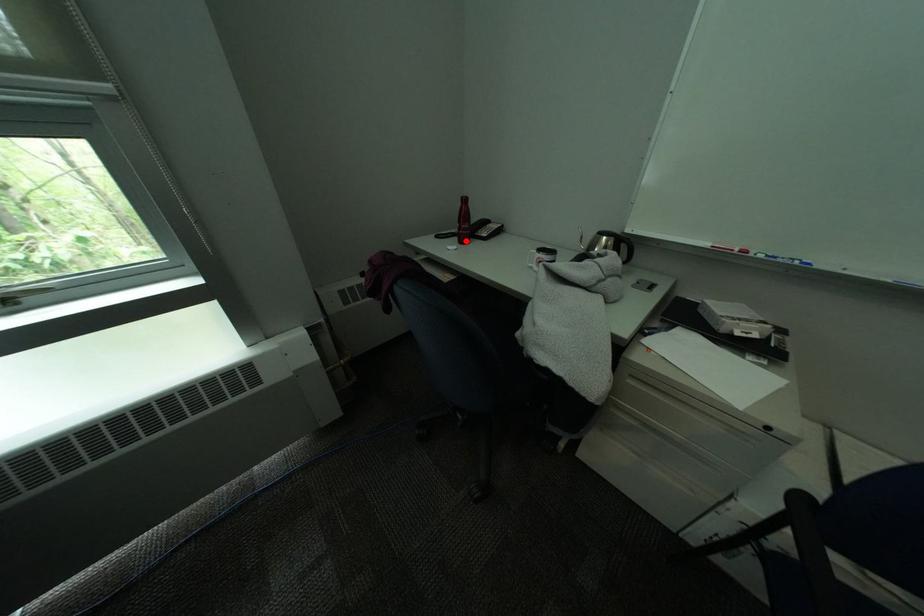
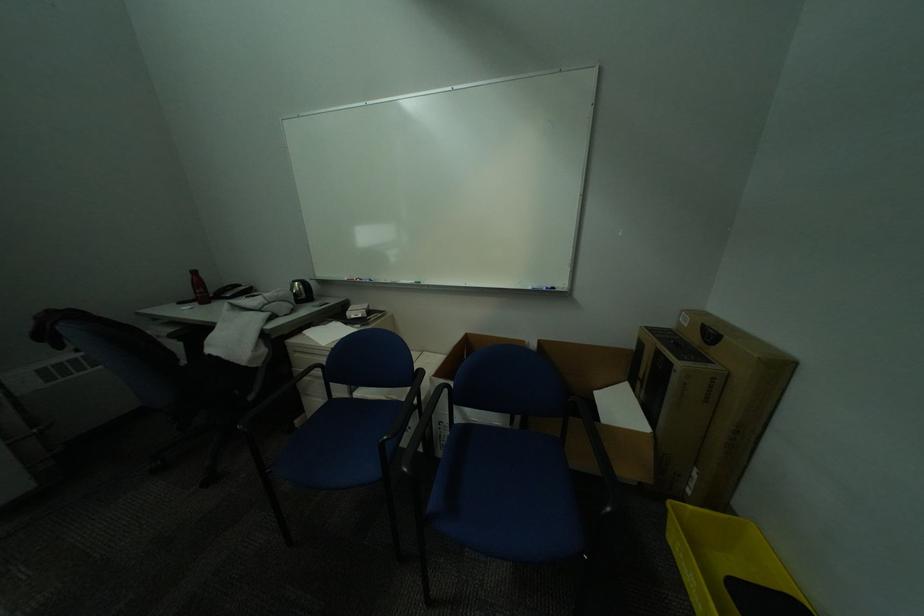
Question: I am providing you with two images of the same scene from different viewpoints. In image1, a red point is highlighted. Considering the same 3D point in image2, which of the following is correct?

Choices:
 (A) It is closer
 (B) It is farther

Answer: (B)